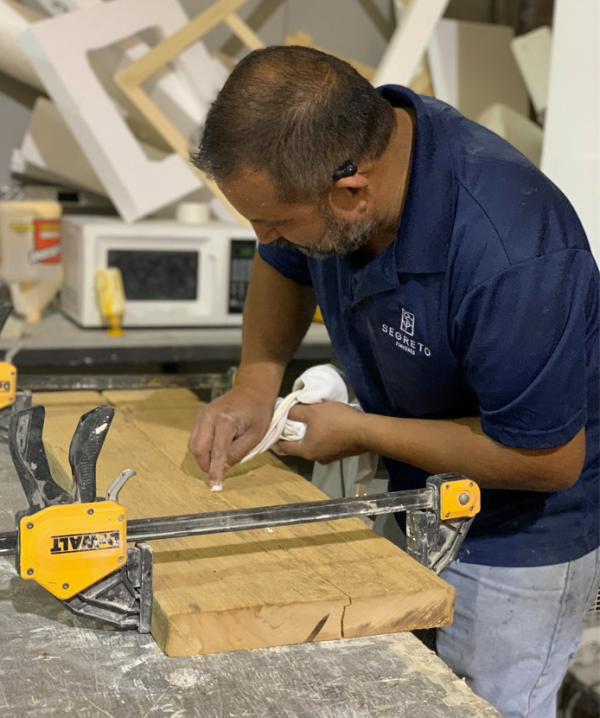
In order to click on white cloth in this screenshot , I will do `click(320, 383)`.